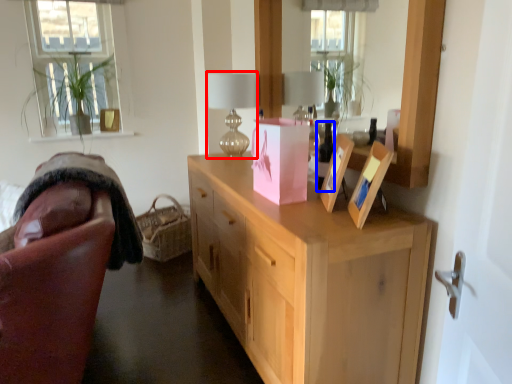
Question: Which point is further to the camera, table lamp (highlighted by a red box) or wine bottle (highlighted by a blue box)?

Choices:
 (A) table lamp
 (B) wine bottle

Answer: (A)